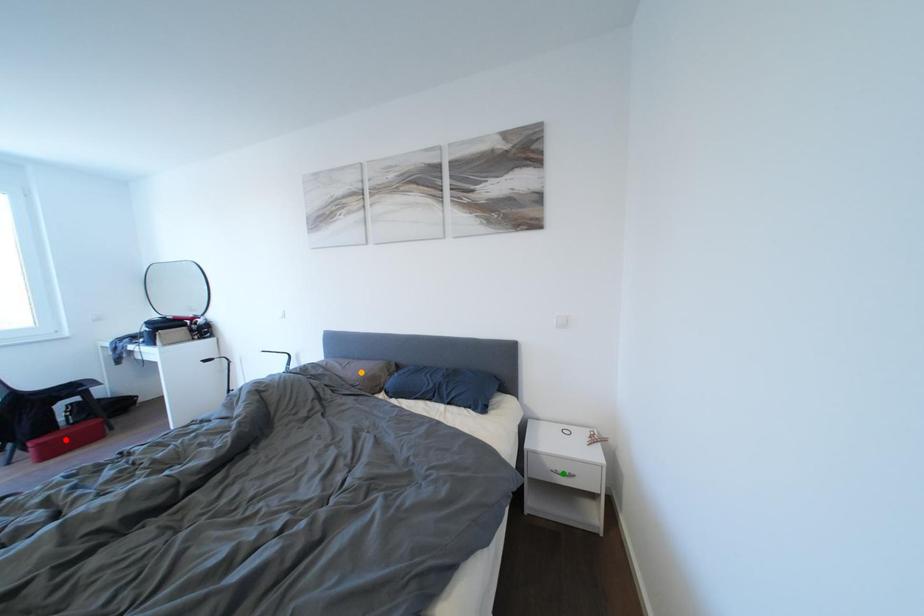
Order these from nearest to farthest:
- orange point
- green point
- red point

green point
orange point
red point